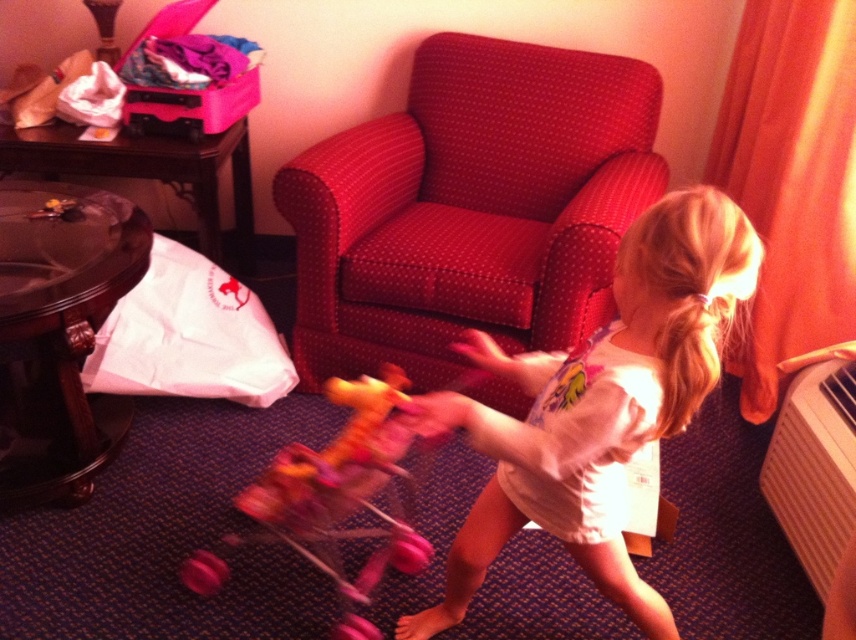
You are a parent in a hotel room and want to move the pink plastic baby carriage at center to the bathroom, which is behind the polka dot fabric armchair at center. Can you move it directly without moving the armchair first?

The pink plastic baby carriage at center is behind the polka dot fabric armchair at center, so you cannot move it directly without moving the armchair first because the armchair is blocking the path.

You are a hotel guest who wants to place a rectangular box that is 1.2 meters wide on the floor. Based on the scene, which object can you use as a reference to determine if the space between the polka dot fabric armchair at center and the white plastic radiator at lower right is wide enough?

The polka dot fabric armchair at center is wider than the white plastic radiator at lower right. Since the armchair is wider, the space between them might be sufficient for the 1.2 meter box. However, without exact measurements, it is recommended to check the distance between them before placing the box.